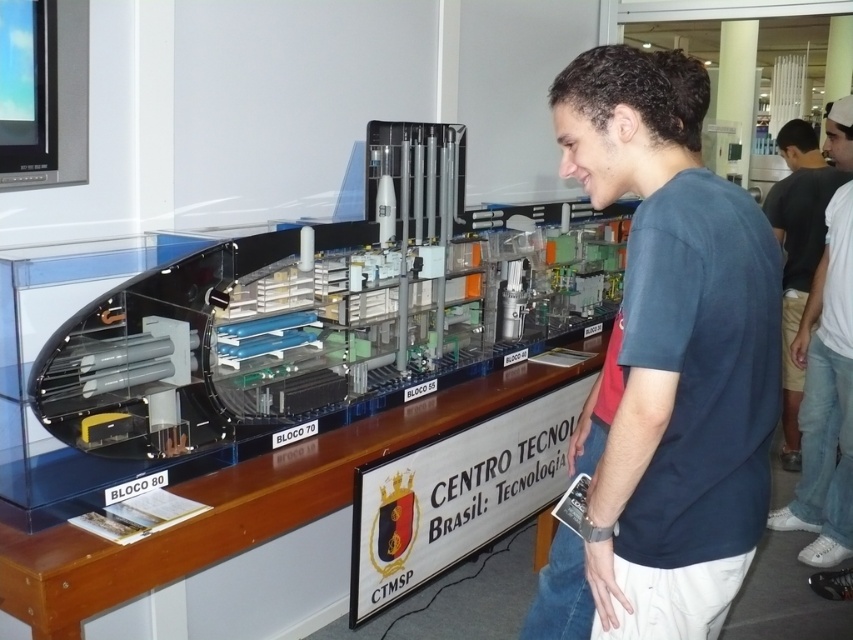
You are standing in front of the model of the technological structure. There are two points marked on the display stand sign, labeled as point (770, 372) and point (788, 374). Which of these two points is closer to you?

Point (770, 372) is closer to the viewer than point (788, 374).